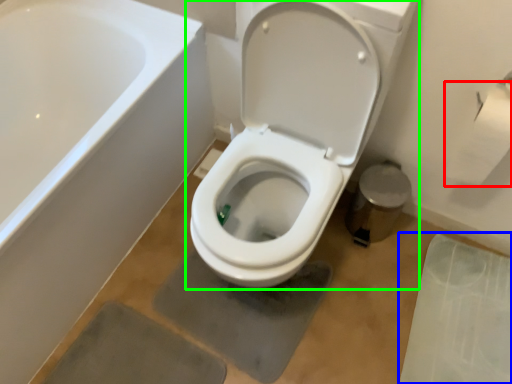
Question: Which is nearer to the toilet paper (highlighted by a red box)? concrete (highlighted by a blue box) or toilet (highlighted by a green box).

Choices:
 (A) concrete
 (B) toilet

Answer: (B)